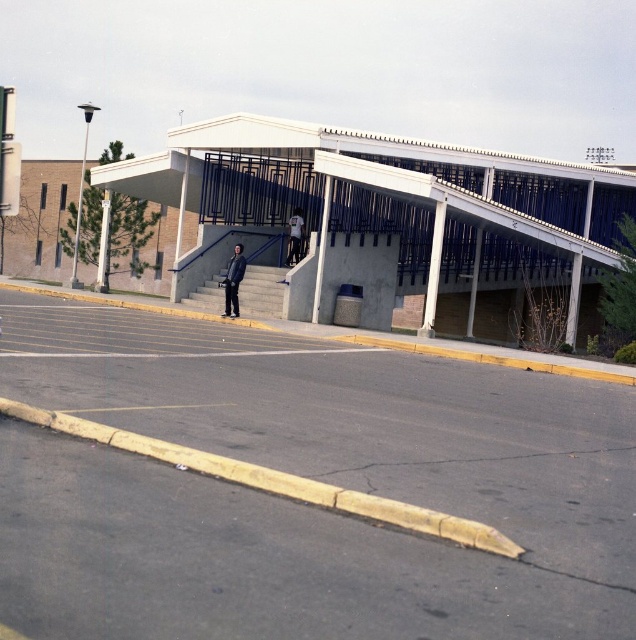
You are standing at the entrance of the building and see the dark blue jacket at center represented by point (233, 282). Is the person wearing the dark blue jacket at center closer to the walkway or the parking lot?

The dark blue jacket at center represented by point (233, 282) is closer to the walkway since the walkway is elevated above the parking lot.

You are standing at the entrance of the building and want to reach the point marked by point (184, 435) and point (294, 227). Which point should you walk towards first to reach both in the shortest path?

You should walk towards point (184, 435) first because it is in front of point (294, 227), so reaching it first allows you to then move backward to the second point without backtracking.